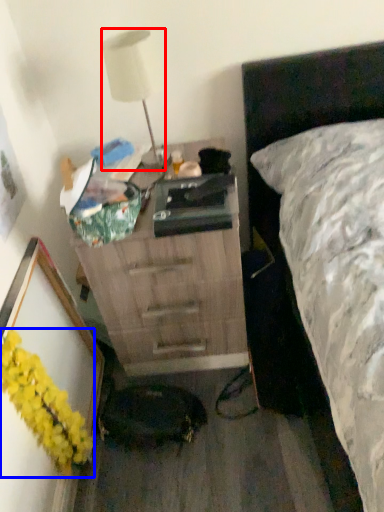
Question: Which point is further to the camera, lamp (highlighted by a red box) or flower (highlighted by a blue box)?

Choices:
 (A) lamp
 (B) flower

Answer: (A)